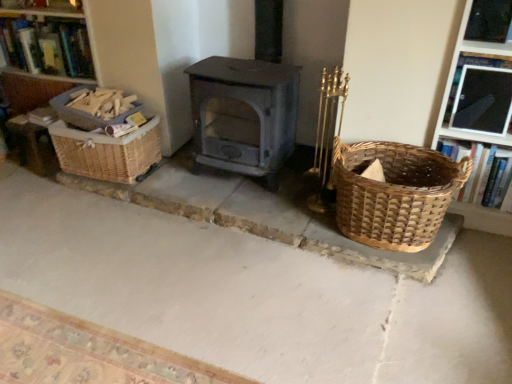
Find the location of a particular element. Image resolution: width=512 pixels, height=384 pixels. free area below white woven mat at lower center (from a real-world perspective) is located at coordinates (78, 346).